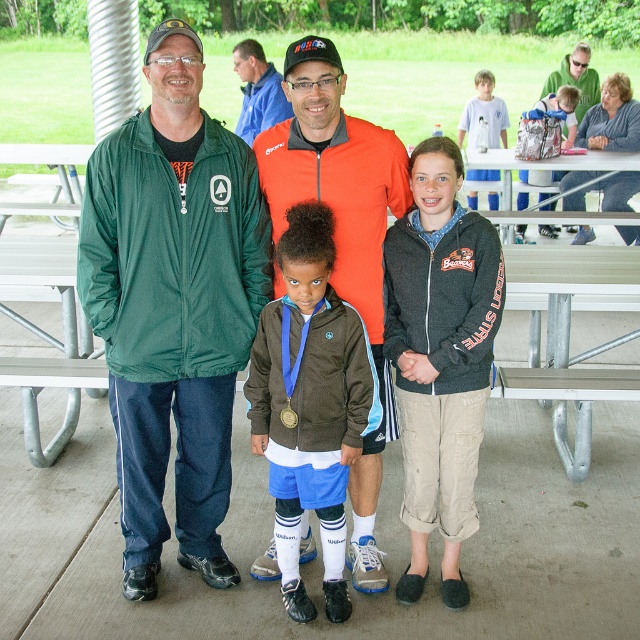
Can you confirm if blue fleece jacket at center is taller than silver metallic backpack at upper right?

In fact, blue fleece jacket at center may be shorter than silver metallic backpack at upper right.

Is point (256, 45) positioned before point (520, 200)?

Yes, point (256, 45) is closer to viewer.

The image size is (640, 640). In order to click on blue fleece jacket at center in this screenshot , I will do pos(257,90).

Consider the image. Who is more distant from viewer, (237, 336) or (468, 189)?

Point (468, 189)

How distant is green fleece jacket at left from light blue jersey at center?

green fleece jacket at left and light blue jersey at center are 7.15 meters apart.

Between point (129, 486) and point (468, 145), which one is positioned behind?

The point (468, 145) is behind.

Where is `green fleece jacket at left`? The image size is (640, 640). green fleece jacket at left is located at coordinates (173, 305).

Who is more forward, (250, 120) or (493, 116)?

Point (250, 120) is in front.

Which is below, blue fleece jacket at center or light blue jersey at center?

blue fleece jacket at center is below.

Is point (237, 134) behind point (474, 195)?

No, it is in front of (474, 195).

The height and width of the screenshot is (640, 640). Find the location of `blue fleece jacket at center`. blue fleece jacket at center is located at coordinates (257, 90).